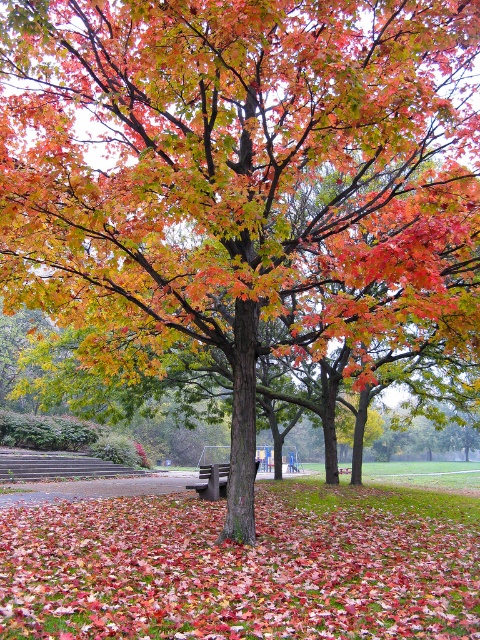
Question: Can you confirm if fallen leaves at center is wider than wooden bench at center?

Choices:
 (A) yes
 (B) no

Answer: (A)

Question: Which point is closer to the camera taking this photo?

Choices:
 (A) (205, 472)
 (B) (372, 582)

Answer: (B)

Question: Can you confirm if fallen leaves at center is positioned above wooden bench at center?

Choices:
 (A) yes
 (B) no

Answer: (A)

Question: Is fallen leaves at center closer to camera compared to wooden bench at center?

Choices:
 (A) no
 (B) yes

Answer: (B)

Question: Among these points, which one is farthest from the camera?

Choices:
 (A) (200, 476)
 (B) (2, 608)

Answer: (A)